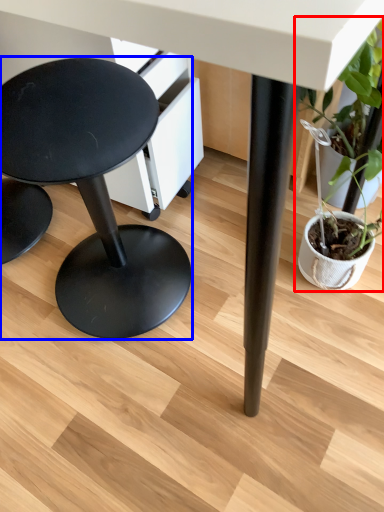
Question: Which point is further to the camera, houseplant (highlighted by a red box) or stool (highlighted by a blue box)?

Choices:
 (A) houseplant
 (B) stool

Answer: (A)